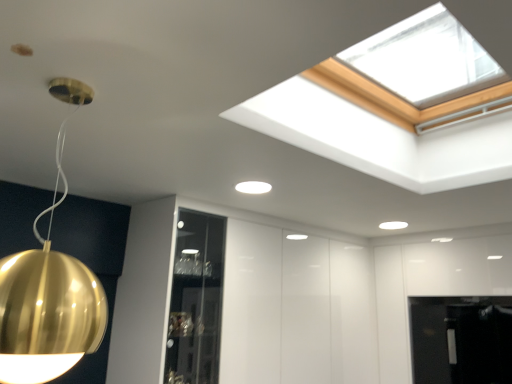
Question: Is white matte light fixture at upper center, the first lamp when ordered from bottom to top, inside the boundaries of gold reflective sphere at left, the 1th lamp viewed from the front, or outside?

Choices:
 (A) inside
 (B) outside

Answer: (B)

Question: From the image's perspective, relative to gold reflective sphere at left, the second lamp when ordered from bottom to top, is white matte light fixture at upper center, which appears as the second lamp when viewed from the front, above or below?

Choices:
 (A) above
 (B) below

Answer: (B)

Question: In terms of height, does white matte light fixture at upper center, the 1th lamp in the back-to-front sequence, look taller or shorter compared to gold reflective sphere at left, the 1th lamp viewed from the front?

Choices:
 (A) tall
 (B) short

Answer: (B)

Question: In terms of height, does gold reflective sphere at left, the second lamp when ordered from back to front, look taller or shorter compared to white matte light fixture at upper center, which is the first lamp from right to left?

Choices:
 (A) tall
 (B) short

Answer: (A)

Question: Do you think gold reflective sphere at left, the second lamp when ordered from back to front, is within white matte light fixture at upper center, the 2th lamp positioned from the top, or outside of it?

Choices:
 (A) outside
 (B) inside

Answer: (A)

Question: Is gold reflective sphere at left, marked as the first lamp in a top-to-bottom arrangement, in front of or behind white matte light fixture at upper center, which appears as the second lamp when viewed from the front, in the image?

Choices:
 (A) front
 (B) behind

Answer: (A)

Question: Looking at their shapes, would you say gold reflective sphere at left, the 1th lamp viewed from the front, is wider or thinner than white matte light fixture at upper center, the first lamp when ordered from bottom to top?

Choices:
 (A) thin
 (B) wide

Answer: (B)